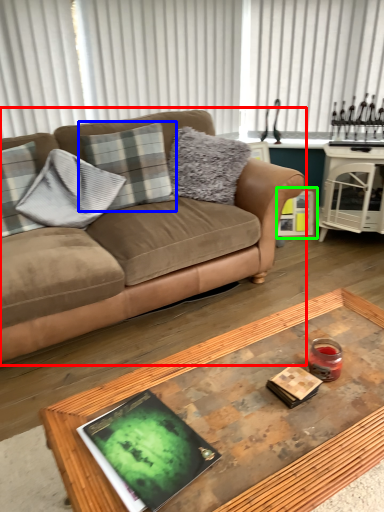
Question: Which is farther away from studio couch (highlighted by a red box)? pillow (highlighted by a blue box) or picture frame (highlighted by a green box)?

Choices:
 (A) pillow
 (B) picture frame

Answer: (B)